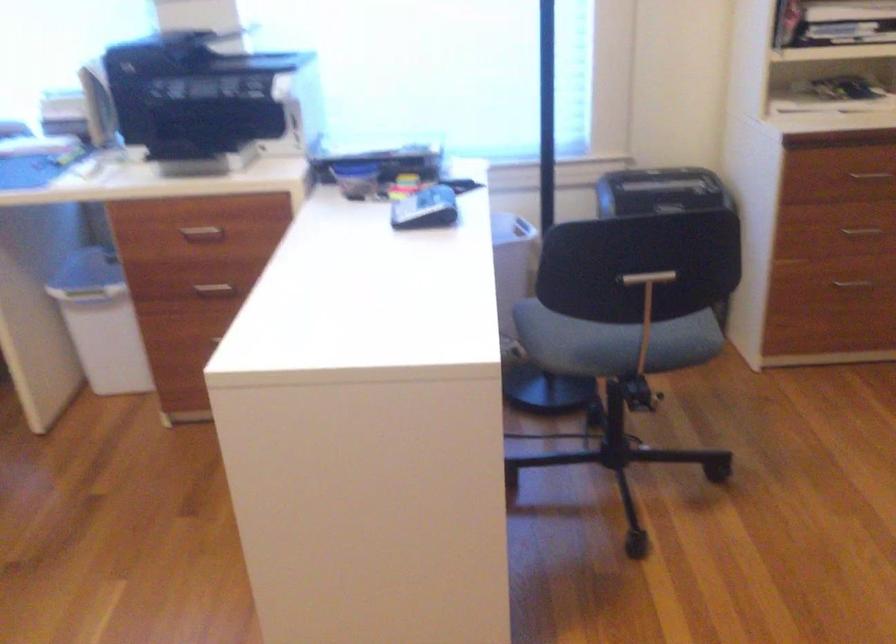
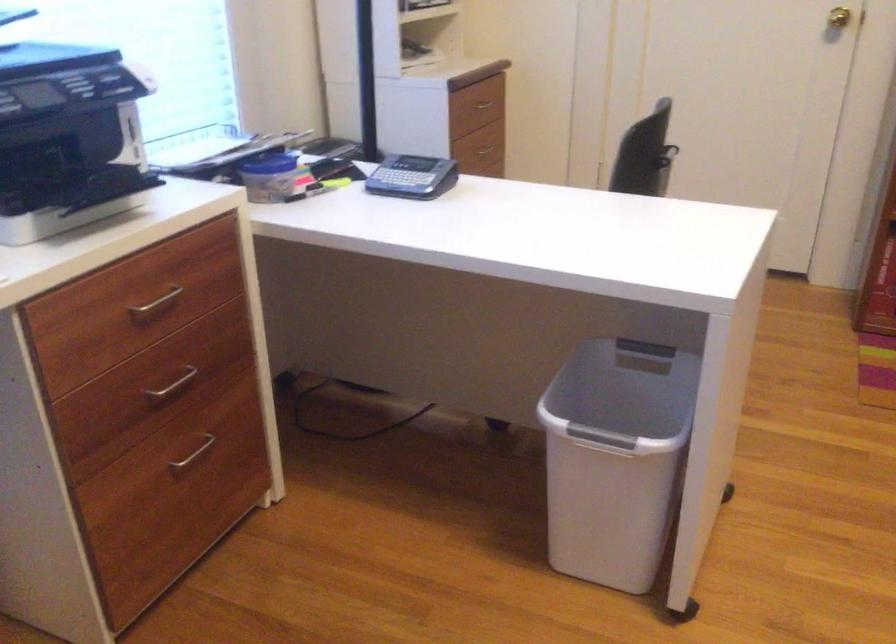
Find the pixel in the second image that matches [462,478] in the first image.

(625, 389)